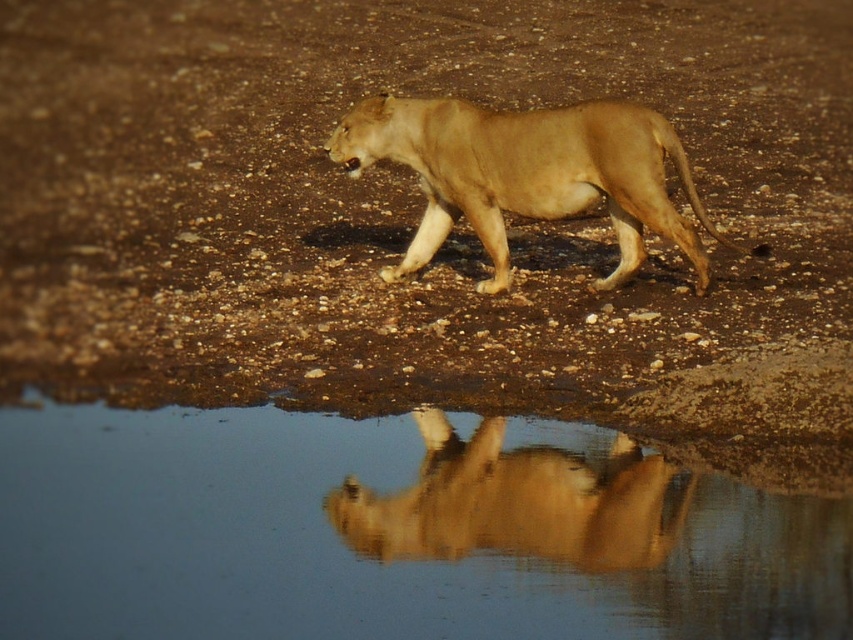
You are a photographer aiming to capture the lioness and her reflection in the water. You notice two points of interest marked as point (473,225) and point (463,445). Which point is closer to your camera position?

Point (473,225) is further to the viewer than point (463,445), so the point closer to your camera position is point (463,445).

You are a photographer trying to capture the lioness in the image. The lioness is at point (527, 173). You want to position your camera so that the lioness is centered in the frame. Which direction should you move the camera to align the lioness with the center of the frame?

The golden fur lion at center is located at point (527, 173). To center the lioness in the frame, you should move the camera so that the point (527, 173) aligns with the center of the frame.